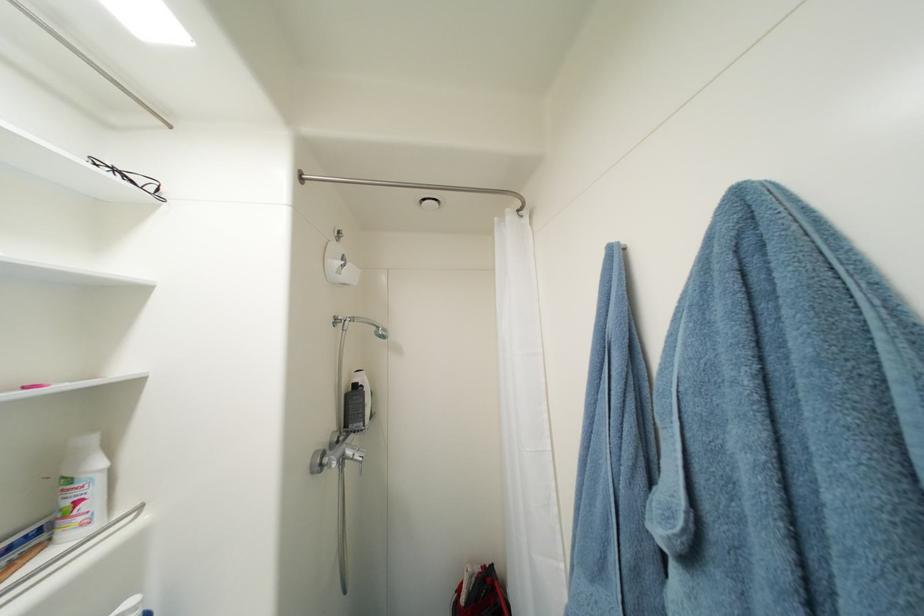
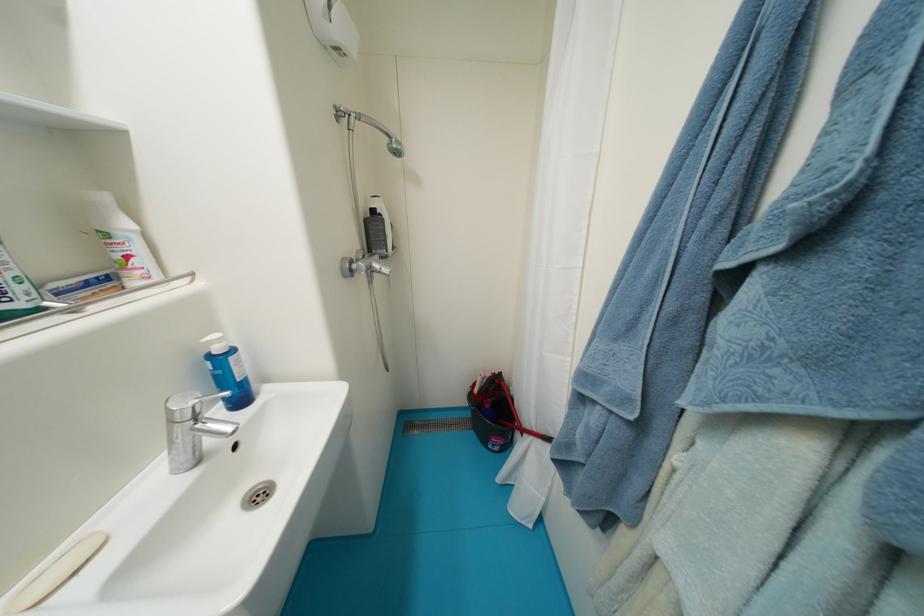
Find the pixel in the second image that matches pixel 84 504 in the first image.

(134, 259)